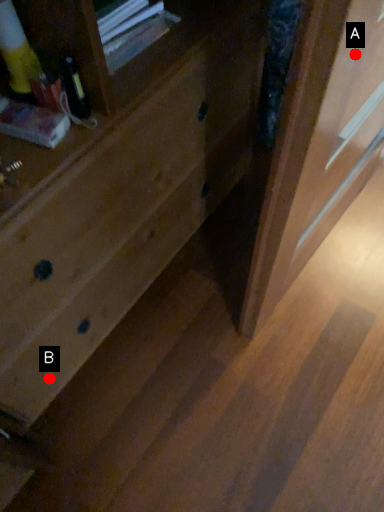
Question: Two points are circled on the image, labeled by A and B beside each circle. Which point is closer to the camera taking this photo?

Choices:
 (A) A is closer
 (B) B is closer

Answer: (A)